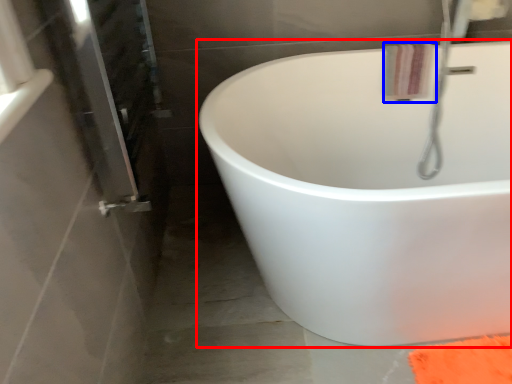
Question: Among these objects, which one is farthest to the camera, bathtub (highlighted by a red box) or bath towel (highlighted by a blue box)?

Choices:
 (A) bathtub
 (B) bath towel

Answer: (B)